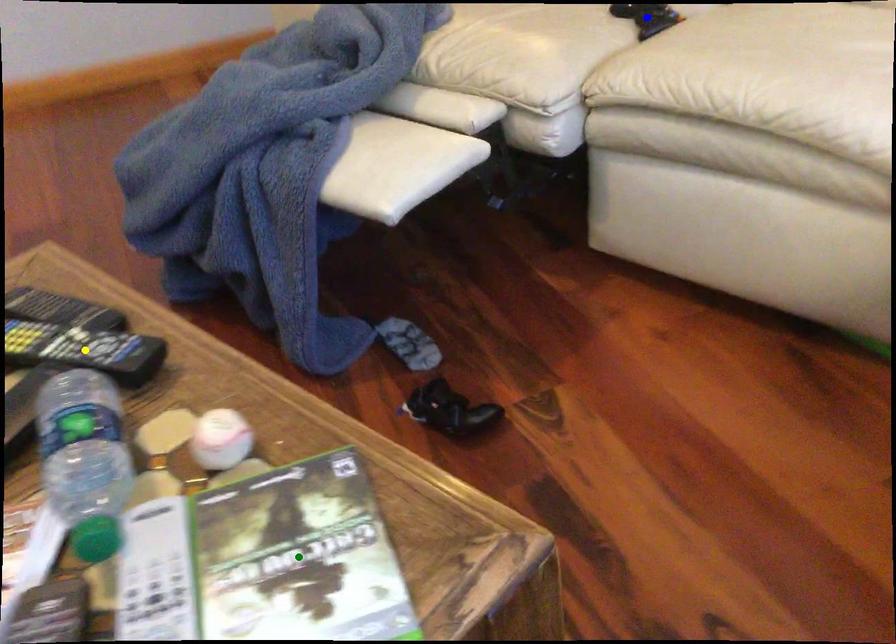
Order these from nearest to farthest:
A) green point
B) blue point
C) yellow point

green point → yellow point → blue point